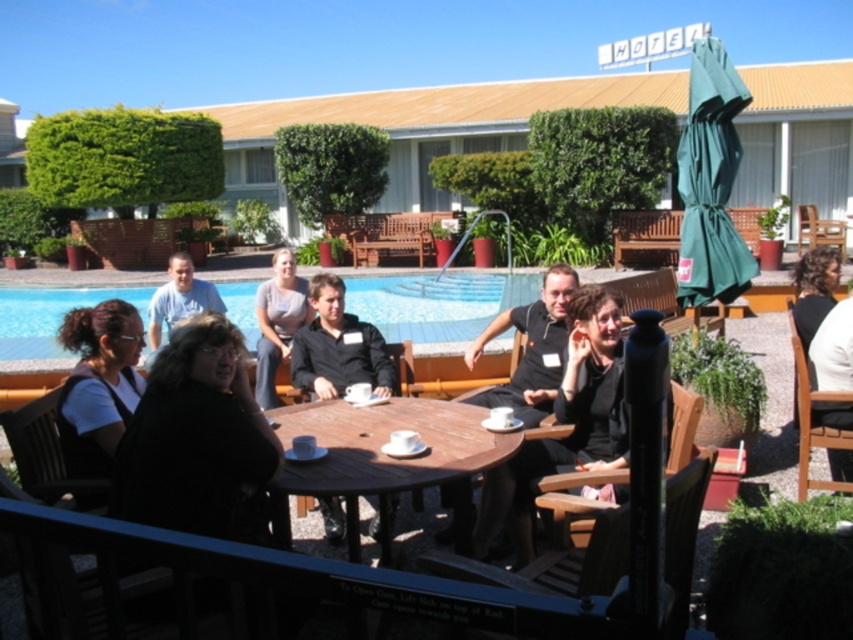
Question: Can you confirm if white matte shirt at lower left is positioned above black matte shirt at center?

Choices:
 (A) no
 (B) yes

Answer: (A)

Question: Which object is positioned farthest from the blue glass swimming pool at center?

Choices:
 (A) black matte shirt at center
 (B) dark brown sweater at lower left

Answer: (A)

Question: Does wooden table at center have a lesser width compared to gray cotton shirt at center?

Choices:
 (A) no
 (B) yes

Answer: (A)

Question: Where is wooden table at center located in relation to black fabric shirt at lower right in the image?

Choices:
 (A) above
 (B) below

Answer: (B)

Question: Which of the following is the closest to the observer?

Choices:
 (A) (548, 378)
 (B) (622, 404)
 (C) (424, 464)
 (D) (254, 371)

Answer: (C)

Question: Which object is closer to the camera taking this photo?

Choices:
 (A) black fabric jacket at center
 (B) gray cotton shirt at center
 (C) white matte shirt at lower left
 (D) black shirt at center

Answer: (A)